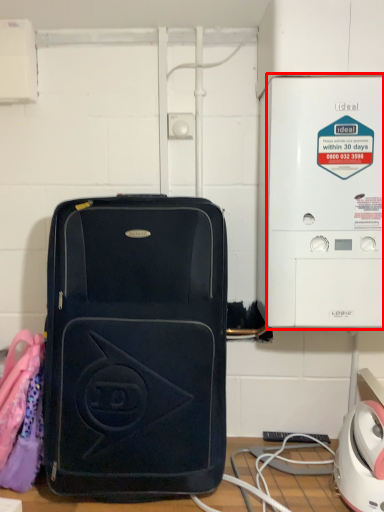
Question: From the image's perspective, where is appliance (annotated by the red box) located relative to luggage and bags?

Choices:
 (A) above
 (B) below

Answer: (A)